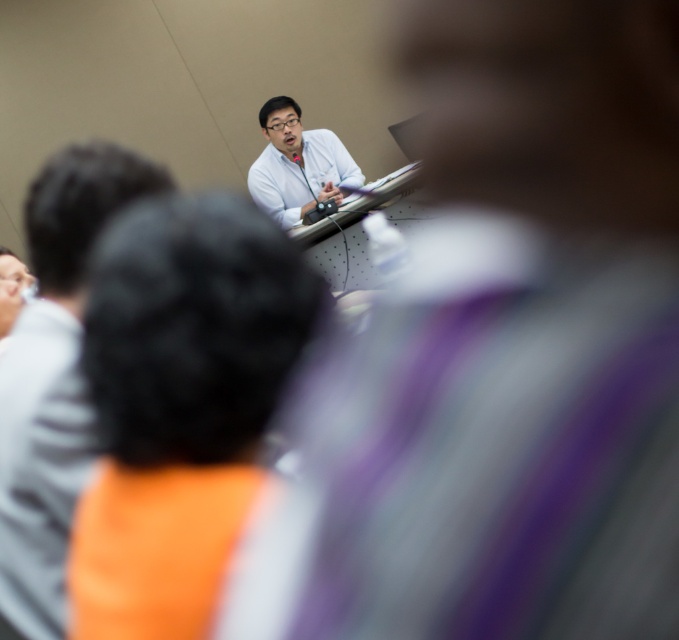
You are an observer in the audience looking at the presenter. You notice two shirts in the image. Which shirt, the matte white shirt at upper center or the white glossy shirt at center, is positioned to the left of the other?

The matte white shirt at upper center is positioned to the left of the white glossy shirt at center.

In the scene shown: You are organizing a photo shoot for a clothing brand and need to arrange two shirts in a display case. The display case has two shelves. The top shelf is shorter than the bottom shelf. You have the matte white shirt at upper center and the white glossy shirt at center. Which shirt should go on the top shelf to ensure they both fit without overlapping?

The matte white shirt at upper center is not as tall as the white glossy shirt at center, so the shorter matte white shirt at upper center should be placed on the top shelf, which is shorter, to ensure both fit without overlapping.